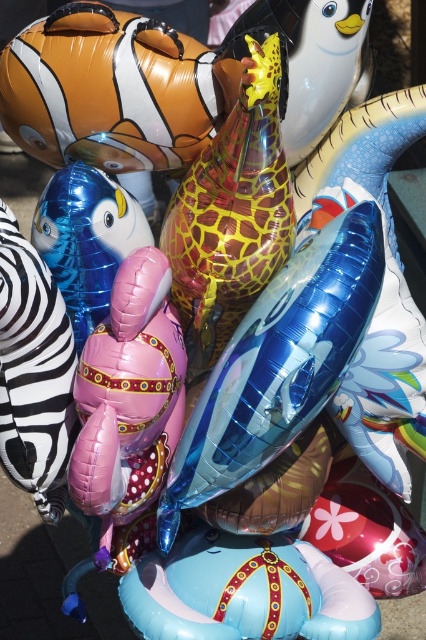
Question: Which of the following is the closest to the observer?

Choices:
 (A) (106, 237)
 (B) (273, 97)

Answer: (B)

Question: Does metallic gold giraffe at center appear over metallic blue balloon at center-left?

Choices:
 (A) yes
 (B) no

Answer: (A)

Question: Is metallic gold giraffe at center wider than metallic blue balloon at center-left?

Choices:
 (A) yes
 (B) no

Answer: (A)

Question: Which object appears farthest from the camera in this image?

Choices:
 (A) metallic blue balloon at center-left
 (B) metallic gold giraffe at center

Answer: (A)

Question: Can you confirm if metallic gold giraffe at center is smaller than metallic blue balloon at center-left?

Choices:
 (A) yes
 (B) no

Answer: (B)